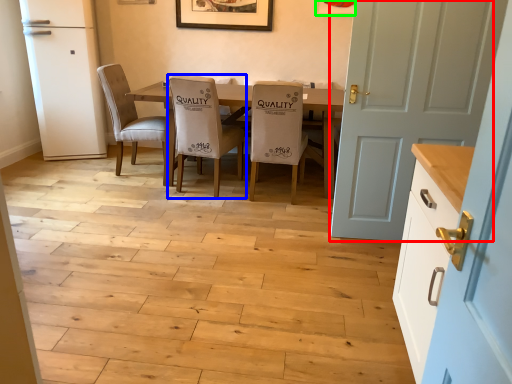
Question: Estimate the real-world distances between objects in this image. Which object is farther from door (highlighted by a red box), chair (highlighted by a blue box) or picture frame (highlighted by a green box)?

Choices:
 (A) chair
 (B) picture frame

Answer: (B)